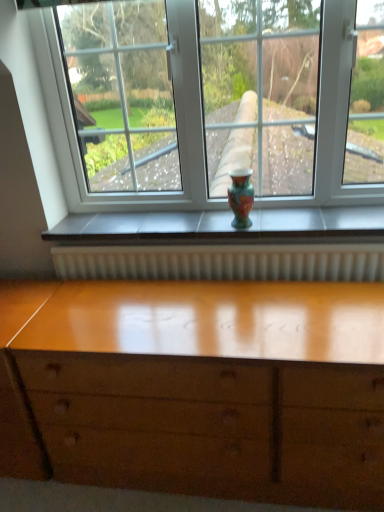
The width and height of the screenshot is (384, 512). Find the location of `glossy wood chest of drawers at lower center`. glossy wood chest of drawers at lower center is located at coordinates (208, 386).

Describe the element at coordinates (208, 386) in the screenshot. Image resolution: width=384 pixels, height=512 pixels. I see `glossy wood chest of drawers at lower center` at that location.

In order to click on multicolored glossy vase at center in this screenshot , I will do `click(241, 197)`.

This screenshot has height=512, width=384. Describe the element at coordinates (241, 197) in the screenshot. I see `multicolored glossy vase at center` at that location.

Where is `glossy wood chest of drawers at lower center`? The height and width of the screenshot is (512, 384). glossy wood chest of drawers at lower center is located at coordinates (208, 386).

Considering the positions of objects glossy wood chest of drawers at lower center and multicolored glossy vase at center in the image provided, who is more to the right, glossy wood chest of drawers at lower center or multicolored glossy vase at center?

Positioned to the right is multicolored glossy vase at center.

From the picture: Does glossy wood chest of drawers at lower center come in front of multicolored glossy vase at center?

Yes, glossy wood chest of drawers at lower center is in front of multicolored glossy vase at center.

Which is in front, point (94, 314) or point (236, 175)?

The point (94, 314) is more forward.

From the image's perspective, does glossy wood chest of drawers at lower center appear lower than multicolored glossy vase at center?

Indeed, from the image's perspective, glossy wood chest of drawers at lower center is shown beneath multicolored glossy vase at center.

From a real-world perspective, between glossy wood chest of drawers at lower center and multicolored glossy vase at center, who is vertically lower?

glossy wood chest of drawers at lower center.

Considering the sizes of objects glossy wood chest of drawers at lower center and multicolored glossy vase at center in the image provided, who is thinner, glossy wood chest of drawers at lower center or multicolored glossy vase at center?

With smaller width is multicolored glossy vase at center.

Is glossy wood chest of drawers at lower center taller than multicolored glossy vase at center?

Correct, glossy wood chest of drawers at lower center is much taller as multicolored glossy vase at center.

In terms of size, does glossy wood chest of drawers at lower center appear bigger or smaller than multicolored glossy vase at center?

In the image, glossy wood chest of drawers at lower center appears to be larger than multicolored glossy vase at center.

Is glossy wood chest of drawers at lower center outside of multicolored glossy vase at center?

Yes.

Is glossy wood chest of drawers at lower center far away from multicolored glossy vase at center?

That's not correct — glossy wood chest of drawers at lower center is a little close to multicolored glossy vase at center.

Could you tell me if glossy wood chest of drawers at lower center is facing multicolored glossy vase at center?

No, glossy wood chest of drawers at lower center is not facing towards multicolored glossy vase at center.

How much distance is there between glossy wood chest of drawers at lower center and multicolored glossy vase at center?

They are 27.68 inches apart.

Locate an element on the screen. This screenshot has height=512, width=384. glass vase on the right of the glossy wood chest of drawers at lower center is located at coordinates (241, 197).

Can you confirm if multicolored glossy vase at center is positioned to the left of glossy wood chest of drawers at lower center?

In fact, multicolored glossy vase at center is to the right of glossy wood chest of drawers at lower center.

In the image, is multicolored glossy vase at center positioned in front of or behind glossy wood chest of drawers at lower center?

multicolored glossy vase at center is positioned farther from the viewer than glossy wood chest of drawers at lower center.

Is point (241, 191) positioned after point (372, 365)?

That is True.

From the image's perspective, relative to glossy wood chest of drawers at lower center, is multicolored glossy vase at center above or below?

multicolored glossy vase at center is situated higher than glossy wood chest of drawers at lower center in the image.

From a real-world perspective, who is located lower, multicolored glossy vase at center or glossy wood chest of drawers at lower center?

glossy wood chest of drawers at lower center is physically lower.

Is multicolored glossy vase at center wider or thinner than glossy wood chest of drawers at lower center?

In the image, multicolored glossy vase at center appears to be more narrow than glossy wood chest of drawers at lower center.

Looking at this image, which of these two, multicolored glossy vase at center or glossy wood chest of drawers at lower center, stands shorter?

With less height is multicolored glossy vase at center.

Between multicolored glossy vase at center and glossy wood chest of drawers at lower center, which one has smaller size?

Smaller between the two is multicolored glossy vase at center.

Would you say multicolored glossy vase at center is outside glossy wood chest of drawers at lower center?

Yes.

Are multicolored glossy vase at center and glossy wood chest of drawers at lower center located far from each other?

Actually, multicolored glossy vase at center and glossy wood chest of drawers at lower center are a little close together.

Is multicolored glossy vase at center facing away from glossy wood chest of drawers at lower center?

No.

How different are the orientations of multicolored glossy vase at center and glossy wood chest of drawers at lower center in degrees?

3.07 degrees separate the facing orientations of multicolored glossy vase at center and glossy wood chest of drawers at lower center.

In the scene shown: Measure the distance between multicolored glossy vase at center and glossy wood chest of drawers at lower center.

27.68 inches.

Locate an element on the screen. The height and width of the screenshot is (512, 384). the chest of drawers that appears below the multicolored glossy vase at center (from a real-world perspective) is located at coordinates (208, 386).

The height and width of the screenshot is (512, 384). I want to click on glass vase above the glossy wood chest of drawers at lower center (from a real-world perspective), so click(x=241, y=197).

Locate an element on the screen. glass vase above the glossy wood chest of drawers at lower center (from the image's perspective) is located at coordinates (241, 197).